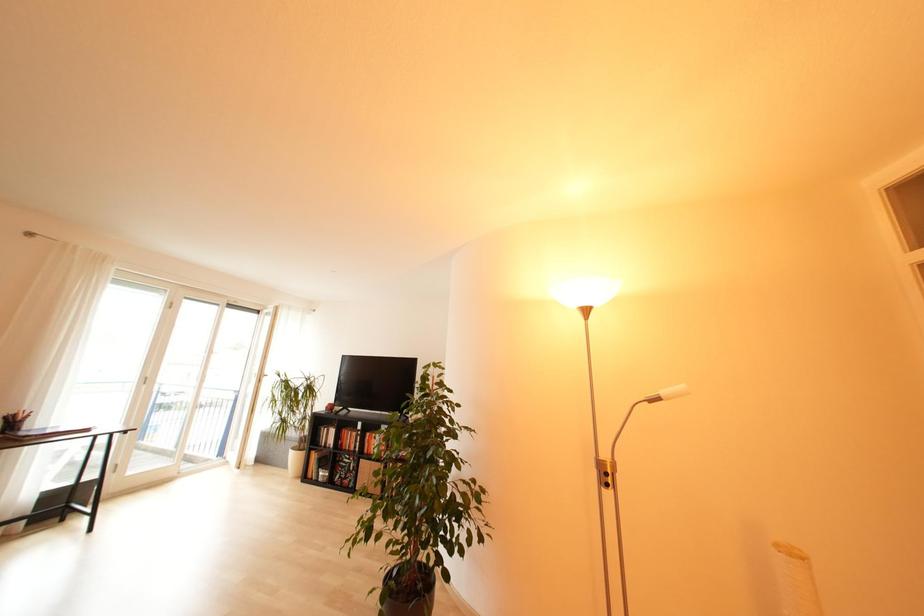
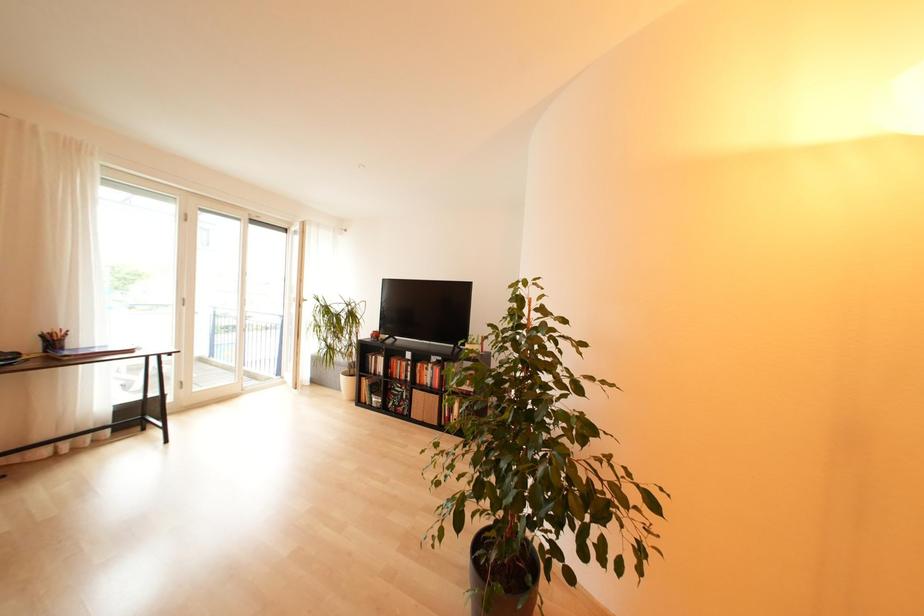
Question: Based on the continuous images, in which direction is the camera rotating? Reply with the corresponding letter.

Choices:
 (A) Left
 (B) Right
 (C) Up
 (D) Down

Answer: (D)